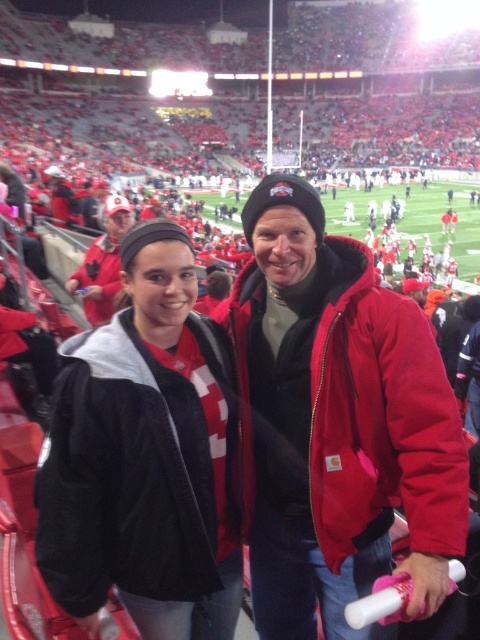
Question: Is red carhartt jacket at center in front of matte red jacket at center?

Choices:
 (A) no
 (B) yes

Answer: (B)

Question: Which point is farther from the camera taking this photo?

Choices:
 (A) (124, 273)
 (B) (305, 211)
 (C) (84, 269)

Answer: (C)

Question: Does red carhartt jacket at center have a larger size compared to matte red jacket at center?

Choices:
 (A) yes
 (B) no

Answer: (A)

Question: Which object appears farthest from the camera in this image?

Choices:
 (A) red carhartt jacket at center
 (B) black fleece jacket at center
 (C) matte red jacket at center

Answer: (C)

Question: Does red carhartt jacket at center appear on the left side of matte red jacket at center?

Choices:
 (A) yes
 (B) no

Answer: (B)

Question: Which point is farther from the camera taking this photo?

Choices:
 (A) (432, 445)
 (B) (213, 352)
 (C) (107, 314)

Answer: (C)